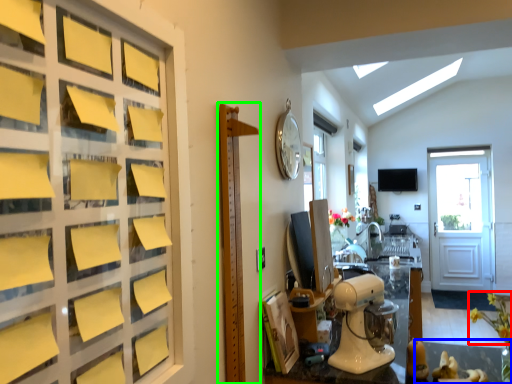
Question: Based on their relative distances, which object is nearer to flower (highlighted by a red box)? Choose from glass table (highlighted by a blue box) and bulletin board (highlighted by a green box).

Choices:
 (A) glass table
 (B) bulletin board

Answer: (A)